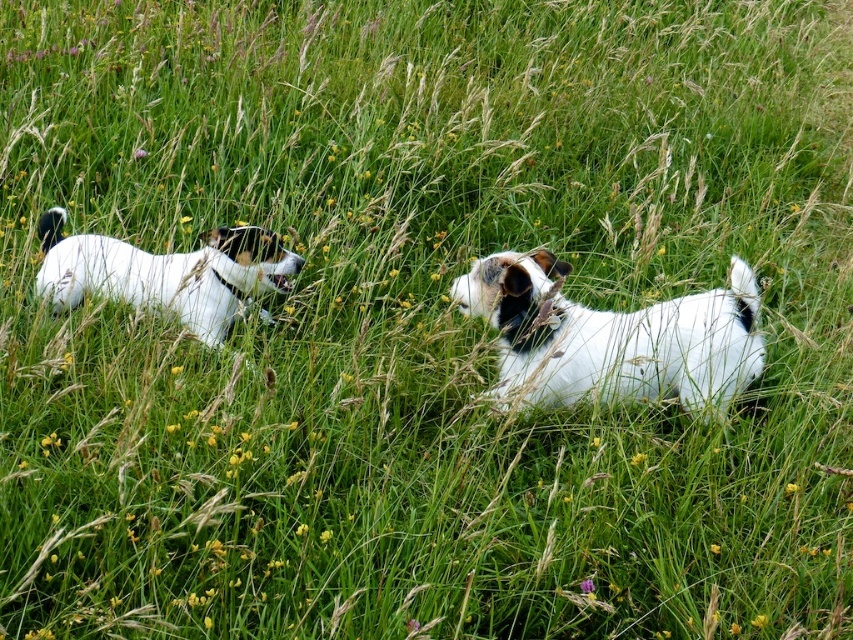
You are a photographer trying to capture both dogs in the frame. Since the white fur dog at center is larger than the white fur dog at left, which dog should you move closer to ensure both are equally visible in the photo?

To ensure both the white fur dog at center and the white fur dog at left are equally visible, you should move closer to the white fur dog at left since it is smaller in size compared to the white fur dog at center.

There are two white fur dog at center in a field. How far apart are they?

The two white fur dog at center are 2.69 meters apart.